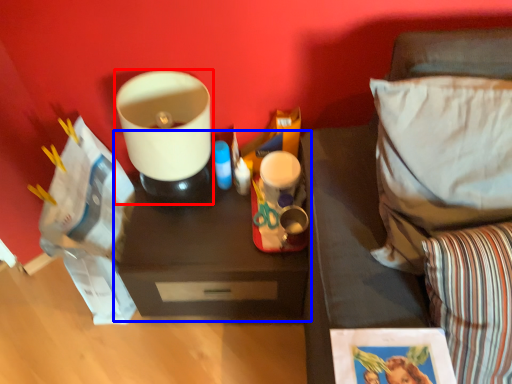
Question: Which of the following is the farthest to the observer, appliance (highlighted by a red box) or table (highlighted by a blue box)?

Choices:
 (A) appliance
 (B) table

Answer: (B)